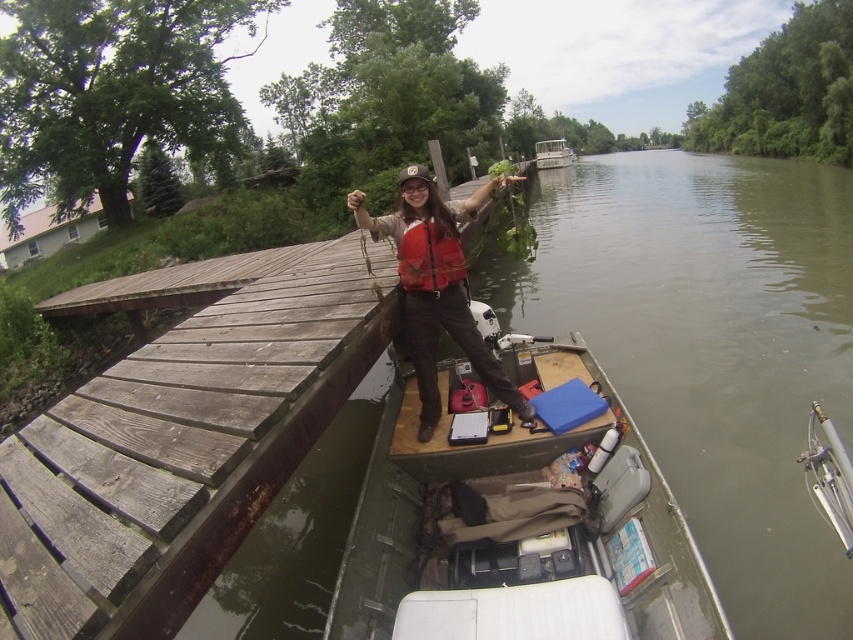
Question: Is weathered wood dock at upper left thinner than green plastic boat at upper center?

Choices:
 (A) yes
 (B) no

Answer: (A)

Question: Which object appears farthest from the camera in this image?

Choices:
 (A) matte orange life vest at center
 (B) wooden table at center
 (C) green plastic boat at upper center
 (D) weathered wood dock at upper left

Answer: (C)

Question: Can you confirm if weathered wood dock at upper left is positioned above green plastic boat at upper center?

Choices:
 (A) no
 (B) yes

Answer: (A)

Question: Which point appears farthest from the camera in this image?

Choices:
 (A) (555, 152)
 (B) (610, 509)

Answer: (A)

Question: Is weathered wood dock at upper left to the left of wooden table at center from the viewer's perspective?

Choices:
 (A) yes
 (B) no

Answer: (A)

Question: Which object is positioned closest to the matte orange life vest at center?

Choices:
 (A) wooden table at center
 (B) green plastic boat at upper center

Answer: (A)